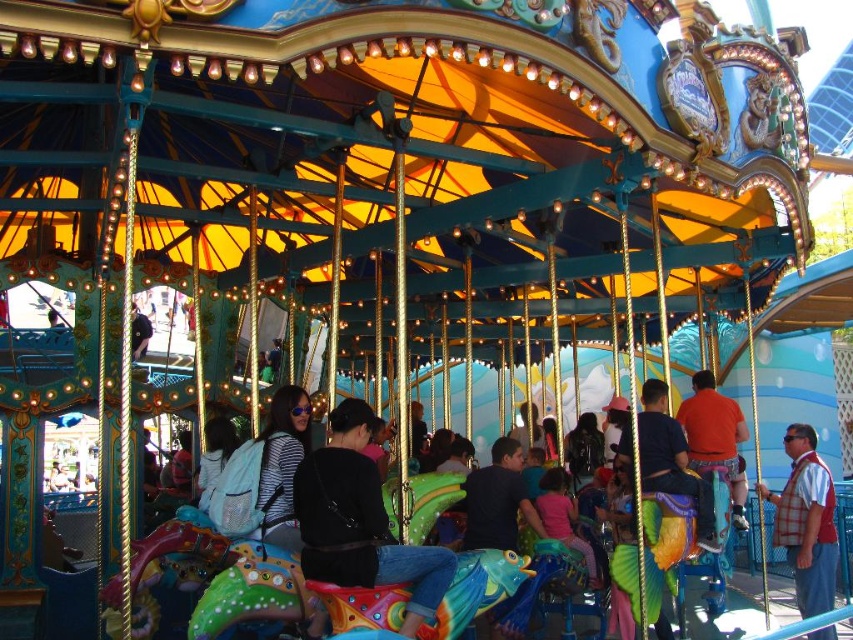
Is point (683, 432) closer to camera compared to point (575, 548)?

No.

Is the position of orange matte shirt at center more distant than that of pink fabric at center?

Yes, it is.

Which is in front, point (698, 426) or point (556, 496)?

Point (698, 426)

This screenshot has width=853, height=640. I want to click on orange matte shirt at center, so click(714, 435).

Between black matte jacket at center and orange matte shirt at center, which one is positioned lower?

orange matte shirt at center

Which is above, black matte jacket at center or orange matte shirt at center?

black matte jacket at center is higher up.

Is point (370, 516) less distant than point (733, 500)?

Yes.

This screenshot has height=640, width=853. Identify the location of black matte jacket at center. (360, 522).

Between black matte jacket at center and pink fabric at center, which one has less height?

pink fabric at center is shorter.

Looking at this image, can you confirm if black matte jacket at center is wider than pink fabric at center?

Correct, the width of black matte jacket at center exceeds that of pink fabric at center.

Does point (341, 456) come behind point (543, 483)?

No, it is not.

This screenshot has width=853, height=640. I want to click on black matte jacket at center, so click(x=360, y=522).